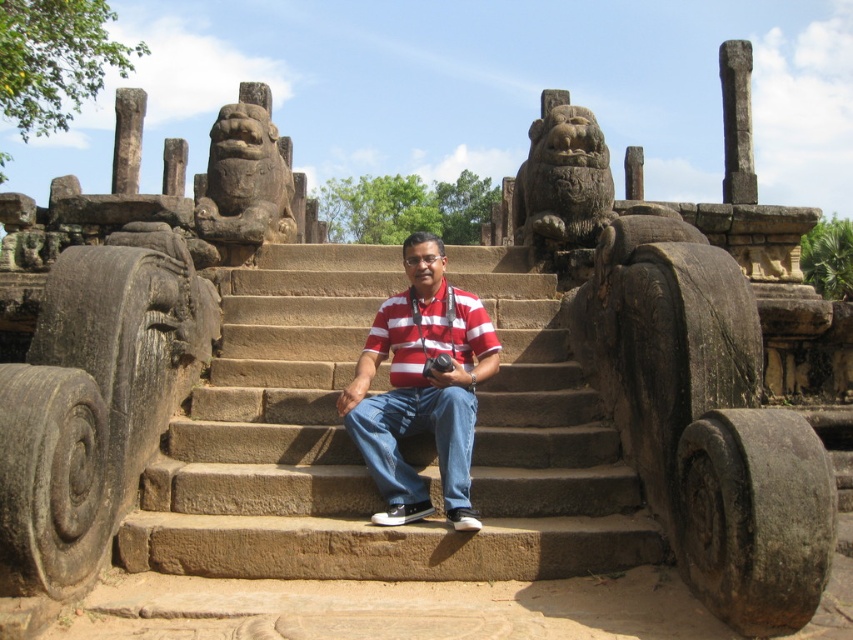
Between brown stone stairs at center and red striped shirt at center, which one has more height?

Standing taller between the two is brown stone stairs at center.

Image resolution: width=853 pixels, height=640 pixels. What do you see at coordinates (399, 442) in the screenshot?
I see `brown stone stairs at center` at bounding box center [399, 442].

At what (x,y) coordinates should I click in order to perform the action: click on brown stone stairs at center. Please return your answer as a coordinate pair (x, y). The height and width of the screenshot is (640, 853). Looking at the image, I should click on pyautogui.click(x=399, y=442).

Who is more forward, (347,388) or (215,172)?

Point (347,388)

Is red striped shirt at center closer to the viewer compared to dark brown stone lion at upper left?

That is True.

In order to click on red striped shirt at center in this screenshot , I will do `click(421, 387)`.

Where is `red striped shirt at center`? red striped shirt at center is located at coordinates (421, 387).

Is dark brown stone lion at upper left to the right of red striped polo shirt at center from the viewer's perspective?

No, dark brown stone lion at upper left is not to the right of red striped polo shirt at center.

Between point (225, 220) and point (480, 312), which one is positioned in front?

Point (480, 312)

Locate an element on the screen. Image resolution: width=853 pixels, height=640 pixels. dark brown stone lion at upper left is located at coordinates (247, 177).